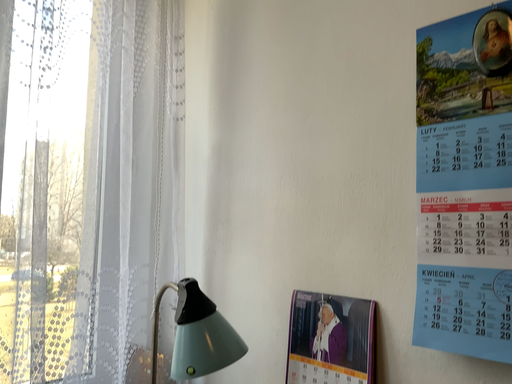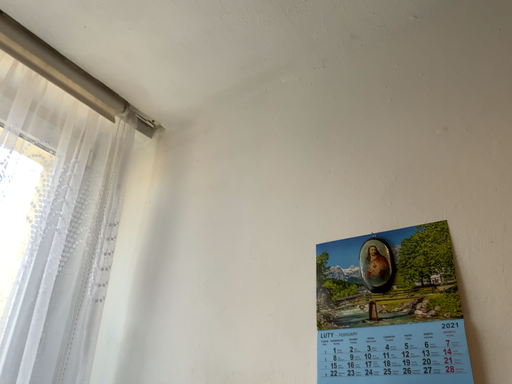
Question: Which way did the camera rotate in the video?

Choices:
 (A) rotated downward
 (B) rotated upward

Answer: (B)